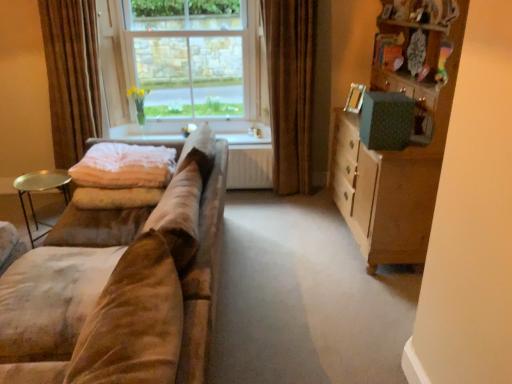
What is the approximate width of brown velvet curtain at center, the 2th curtain viewed from the left?

12.37 inches.

Locate an element on the screen. gold metallic tray at left is located at coordinates (40, 191).

The image size is (512, 384). What do you see at coordinates (185, 61) in the screenshot? I see `clear glass window at center` at bounding box center [185, 61].

Measure the distance between point (184, 208) and camera.

The depth of point (184, 208) is 5.96 feet.

What are the coordinates of `white glossy window sill at center` in the screenshot? It's located at (149, 130).

Between brown velvet curtain at center, the 2th curtain viewed from the left, and brown velvet curtain at left, acting as the second curtain starting from the right, which one has less height?

brown velvet curtain at left, acting as the second curtain starting from the right.

Is brown velvet curtain at center, the 2th curtain viewed from the left, bigger than brown velvet curtain at left, positioned as the 1th curtain in left-to-right order?

Indeed, brown velvet curtain at center, the 2th curtain viewed from the left, has a larger size compared to brown velvet curtain at left, positioned as the 1th curtain in left-to-right order.

Considering the positions of point (276, 72) and point (97, 115), is point (276, 72) closer or farther from the camera than point (97, 115)?

Point (276, 72).

Which is behind, brown velvet curtain at center, the 1th curtain positioned from the right, or brown velvet curtain at left, positioned as the 1th curtain in left-to-right order?

brown velvet curtain at center, the 1th curtain positioned from the right.

Considering the sizes of objects suede couch at left and clear glass window at center in the image provided, who is thinner, suede couch at left or clear glass window at center?

Thinner between the two is clear glass window at center.

Is suede couch at left positioned with its back to clear glass window at center?

No, suede couch at left is not facing away from clear glass window at center.

Can you confirm if suede couch at left is bigger than clear glass window at center?

Yes, suede couch at left is bigger than clear glass window at center.

Considering the points (194, 165) and (103, 59), which point is behind, point (194, 165) or point (103, 59)?

Positioned behind is point (103, 59).

You are a GUI agent. You are given a task and a screenshot of the screen. Output one action in this format:
    pyautogui.click(x=<x>, y=<y>)
    Task: Click on the window above the brown velvet curtain at left, positioned as the 1th curtain in left-to-right order (from the image's perspective)
    This screenshot has width=512, height=384.
    Given the screenshot: What is the action you would take?
    pyautogui.click(x=185, y=61)

In the scene shown: Is brown velvet curtain at left, positioned as the 1th curtain in left-to-right order, positioned with its back to clear glass window at center?

No, clear glass window at center is not at the back of brown velvet curtain at left, positioned as the 1th curtain in left-to-right order.

Could clear glass window at center be considered to be inside brown velvet curtain at left, acting as the second curtain starting from the right?

Definitely not — clear glass window at center is not inside brown velvet curtain at left, acting as the second curtain starting from the right.

Is brown velvet curtain at left, acting as the second curtain starting from the right, not near clear glass window at center?

No, there isn't a large distance between brown velvet curtain at left, acting as the second curtain starting from the right, and clear glass window at center.

Is brown velvet curtain at left, acting as the second curtain starting from the right, wider or thinner than brown velvet curtain at center, the 2th curtain viewed from the left?

brown velvet curtain at left, acting as the second curtain starting from the right, is thinner than brown velvet curtain at center, the 2th curtain viewed from the left.

In terms of height, does brown velvet curtain at left, acting as the second curtain starting from the right, look taller or shorter compared to brown velvet curtain at center, the 1th curtain positioned from the right?

brown velvet curtain at left, acting as the second curtain starting from the right, is shorter than brown velvet curtain at center, the 1th curtain positioned from the right.

Is brown velvet curtain at left, acting as the second curtain starting from the right, positioned far away from brown velvet curtain at center, the 1th curtain positioned from the right?

Yes, brown velvet curtain at left, acting as the second curtain starting from the right, and brown velvet curtain at center, the 1th curtain positioned from the right, are located far from each other.

Is brown velvet curtain at center, the 1th curtain positioned from the right, completely or partially inside brown velvet curtain at left, positioned as the 1th curtain in left-to-right order?

No.

In the scene shown: Is pink soft fabric blanket at left smaller than suede couch at left?

Yes, pink soft fabric blanket at left is smaller than suede couch at left.

Considering the points (84, 157) and (66, 250), which point is behind, point (84, 157) or point (66, 250)?

Positioned behind is point (84, 157).

Identify the location of blanket lying behind the suede couch at left. (124, 166).

Is wooden cabinet at right positioned beyond the bounds of pink soft fabric blanket at left?

Yes, wooden cabinet at right is not within pink soft fabric blanket at left.

From the picture: Considering the positions of objects wooden cabinet at right and pink soft fabric blanket at left in the image provided, who is in front, wooden cabinet at right or pink soft fabric blanket at left?

wooden cabinet at right is closer to the camera.

Is wooden cabinet at right oriented away from pink soft fabric blanket at left?

No, pink soft fabric blanket at left is not at the back of wooden cabinet at right.

Is wooden cabinet at right at the right side of pink soft fabric blanket at left?

Yes, wooden cabinet at right is to the right of pink soft fabric blanket at left.

Measure the distance from brown velvet curtain at left, acting as the second curtain starting from the right, to wooden cabinet at right.

brown velvet curtain at left, acting as the second curtain starting from the right, and wooden cabinet at right are 7.45 feet apart from each other.

Can you confirm if brown velvet curtain at left, acting as the second curtain starting from the right, is wider than wooden cabinet at right?

No.

Between brown velvet curtain at left, acting as the second curtain starting from the right, and wooden cabinet at right, which one appears on the right side from the viewer's perspective?

Positioned to the right is wooden cabinet at right.

Who is shorter, brown velvet curtain at left, acting as the second curtain starting from the right, or wooden cabinet at right?

Standing shorter between the two is brown velvet curtain at left, acting as the second curtain starting from the right.

This screenshot has width=512, height=384. In order to click on curtain that is under the brown velvet curtain at left, acting as the second curtain starting from the right (from a real-world perspective) in this screenshot , I will do `click(290, 89)`.

Locate an element on the screen. The image size is (512, 384). studio couch on the left of clear glass window at center is located at coordinates (123, 288).

Looking at the image, which one is located closer to wooden cabinet at right, white glossy window sill at center or suede couch at left?

The object closer to wooden cabinet at right is suede couch at left.

When comparing their distances from suede couch at left, does clear glass window at center or pink soft fabric blanket at left seem closer?

pink soft fabric blanket at left is positioned closer to the anchor suede couch at left.

Estimate the real-world distances between objects in this image. Which object is closer to suede couch at left, gold metallic tray at left or white glossy window sill at center?

Based on the image, gold metallic tray at left appears to be nearer to suede couch at left.

Based on the photo, which object lies further to the anchor point suede couch at left, brown velvet curtain at center, the 1th curtain positioned from the right, or wooden cabinet at right?

brown velvet curtain at center, the 1th curtain positioned from the right.

Considering their positions, is white glossy window sill at center positioned further to brown velvet curtain at left, positioned as the 1th curtain in left-to-right order, than clear glass window at center?

Among the two, clear glass window at center is located further to brown velvet curtain at left, positioned as the 1th curtain in left-to-right order.

Estimate the real-world distances between objects in this image. Which object is closer to gold metallic tray at left, suede couch at left or white glossy window sill at center?

white glossy window sill at center lies closer to gold metallic tray at left than the other object.

Considering their positions, is brown velvet curtain at center, the 2th curtain viewed from the left, positioned further to suede couch at left than white glossy window sill at center?

brown velvet curtain at center, the 2th curtain viewed from the left.

From the image, which object appears to be nearer to white glossy window sill at center, wooden cabinet at right or clear glass window at center?

clear glass window at center is positioned closer to the anchor white glossy window sill at center.

This screenshot has width=512, height=384. In order to click on window sill situated between brown velvet curtain at left, positioned as the 1th curtain in left-to-right order, and brown velvet curtain at center, the 1th curtain positioned from the right, from left to right in this screenshot , I will do `click(149, 130)`.

Identify the location of window between brown velvet curtain at left, positioned as the 1th curtain in left-to-right order, and wooden cabinet at right. The height and width of the screenshot is (384, 512). click(185, 61).

This screenshot has width=512, height=384. Identify the location of window located between wooden cabinet at right and white glossy window sill at center in the depth direction. (185, 61).

Identify the location of studio couch between gold metallic tray at left and wooden cabinet at right. (123, 288).